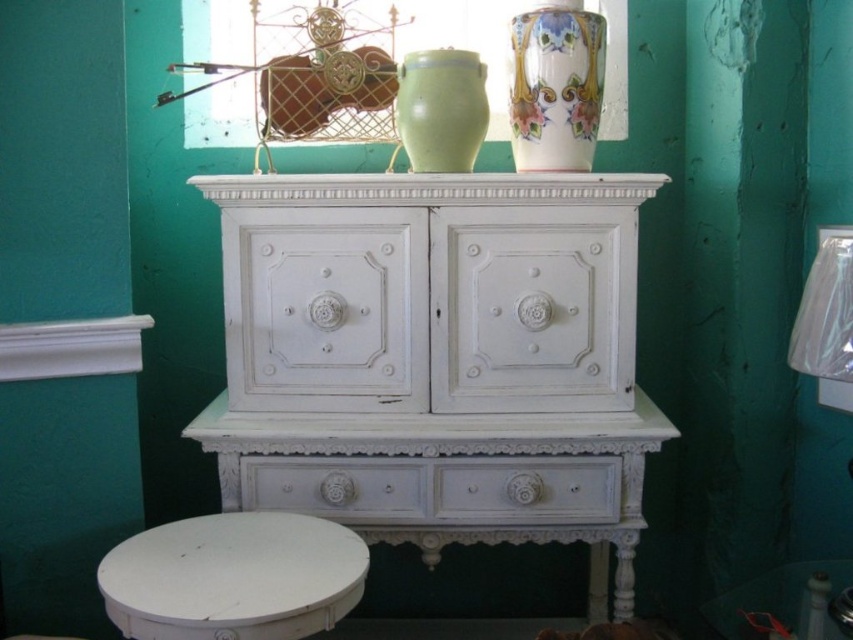
Find the location of a particular element. white painted wood table at lower center is located at coordinates (233, 577).

Which is more to the left, white painted wood table at lower center or matte glass window at upper center?

white painted wood table at lower center

You are a GUI agent. You are given a task and a screenshot of the screen. Output one action in this format:
    pyautogui.click(x=<x>, y=<y>)
    Task: Click on the white painted wood table at lower center
    The width and height of the screenshot is (853, 640).
    Given the screenshot: What is the action you would take?
    pyautogui.click(x=233, y=577)

Image resolution: width=853 pixels, height=640 pixels. Find the location of `white painted wood table at lower center`. white painted wood table at lower center is located at coordinates (233, 577).

Is white distressed wood dresser at center to the left of white painted wood drawer at center from the viewer's perspective?

Incorrect, white distressed wood dresser at center is not on the left side of white painted wood drawer at center.

Who is more distant from viewer, (x=256, y=205) or (x=415, y=502)?

The point (x=415, y=502) is behind.

Is point (585, 541) farther from camera compared to point (398, 464)?

Yes, it is behind point (398, 464).

The height and width of the screenshot is (640, 853). I want to click on white distressed wood dresser at center, so click(442, 344).

Is point (229, 83) behind point (315, 474)?

That is True.

Does point (497, 13) lie in front of point (265, 481)?

No.

Between point (494, 10) and point (410, 481), which one is positioned in front?

Point (410, 481)

I want to click on matte glass window at upper center, so click(451, 36).